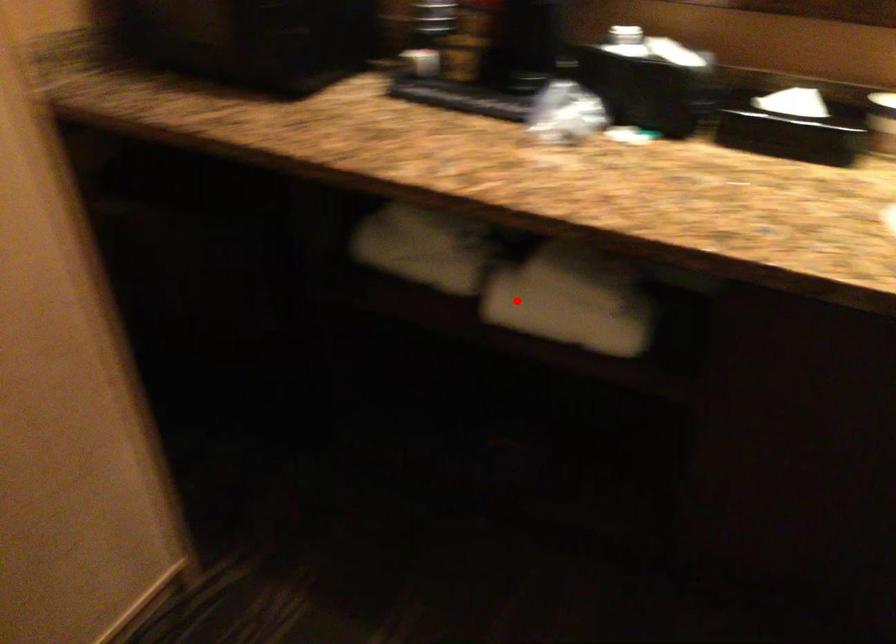
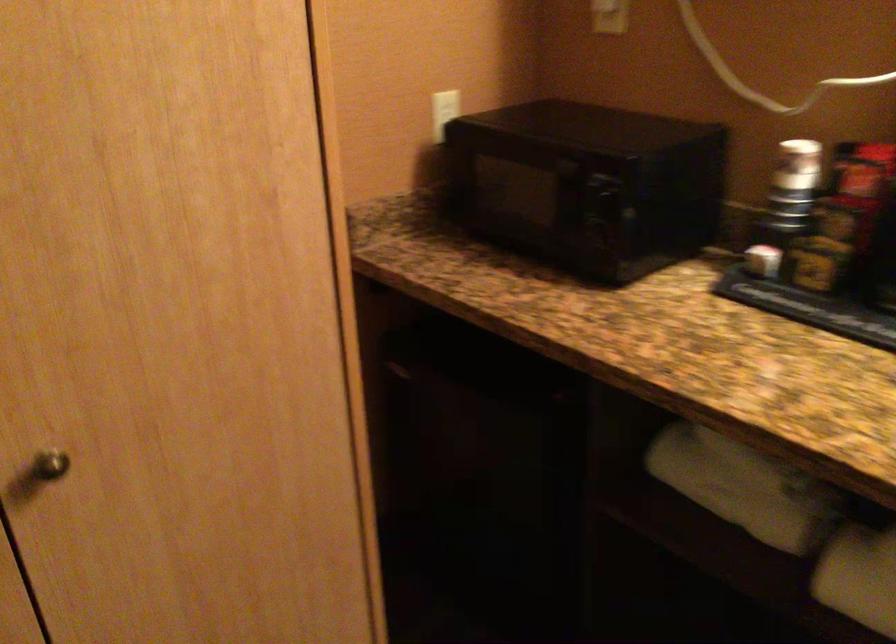
Question: A red point is marked in image1. In image2, is the corresponding 3D point closer to the camera or farther? Reply with the corresponding letter.

Choices:
 (A) The corresponding 3D point is closer.
 (B) The corresponding 3D point is farther.

Answer: (A)